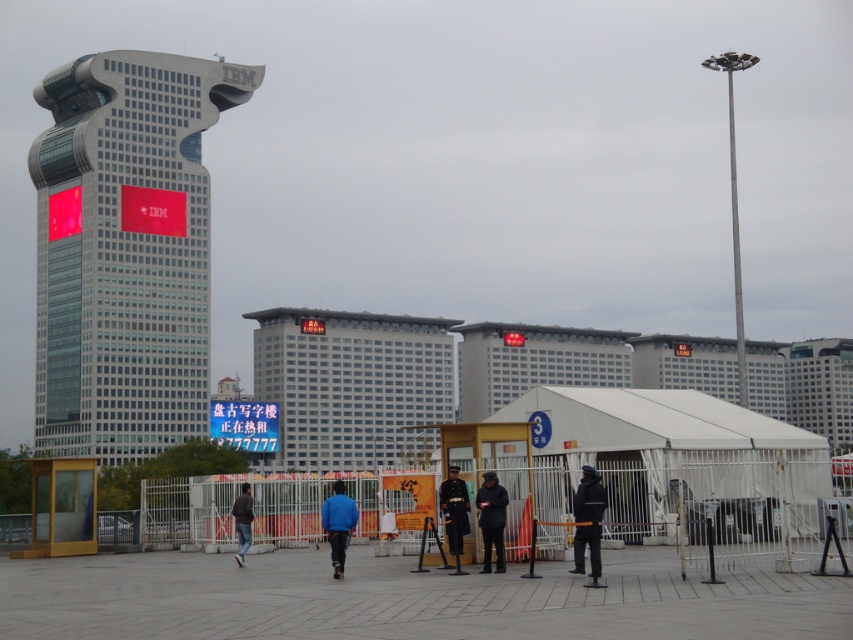
Question: Which point appears farthest from the camera in this image?

Choices:
 (A) (235, 529)
 (B) (457, 528)
 (C) (148, 269)

Answer: (C)

Question: Is glassy gray skyscraper at left bigger than dark blue uniform at center?

Choices:
 (A) no
 (B) yes

Answer: (B)

Question: Does white glass building at center have a smaller size compared to dark blue uniform at center?

Choices:
 (A) no
 (B) yes

Answer: (A)

Question: Does glassy gray skyscraper at left appear under dark blue jacket at center?

Choices:
 (A) no
 (B) yes

Answer: (A)

Question: Which point is farther to the camera?

Choices:
 (A) dark blue uniform at center
 (B) dark gray jacket at center
 (C) glassy gray skyscraper at left
 (D) white glass building at center

Answer: (D)

Question: Which object is positioned farthest from the dark blue jacket at center?

Choices:
 (A) glassy gray skyscraper at left
 (B) dark blue uniform at center
 (C) dark gray jacket at center
 (D) dark gray uniform at center

Answer: (A)